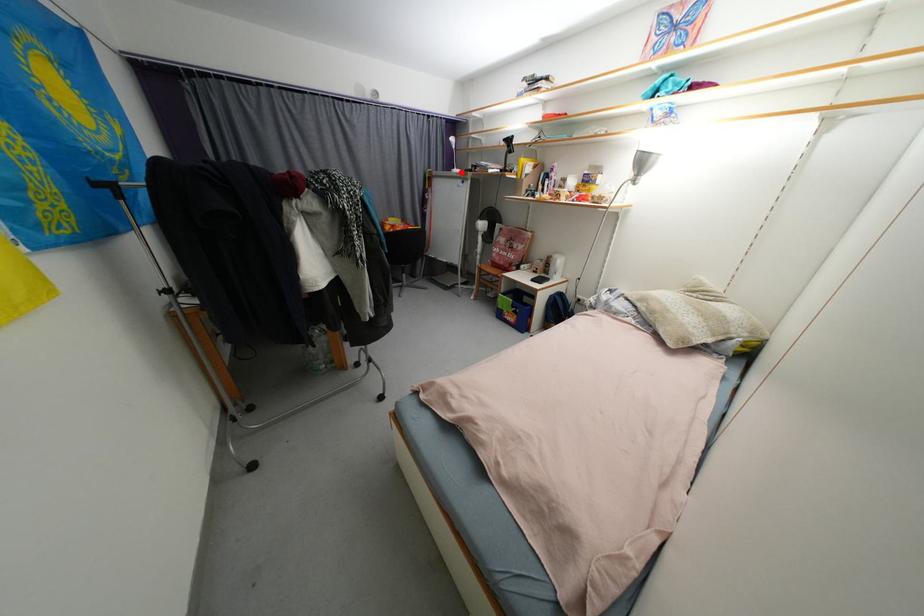
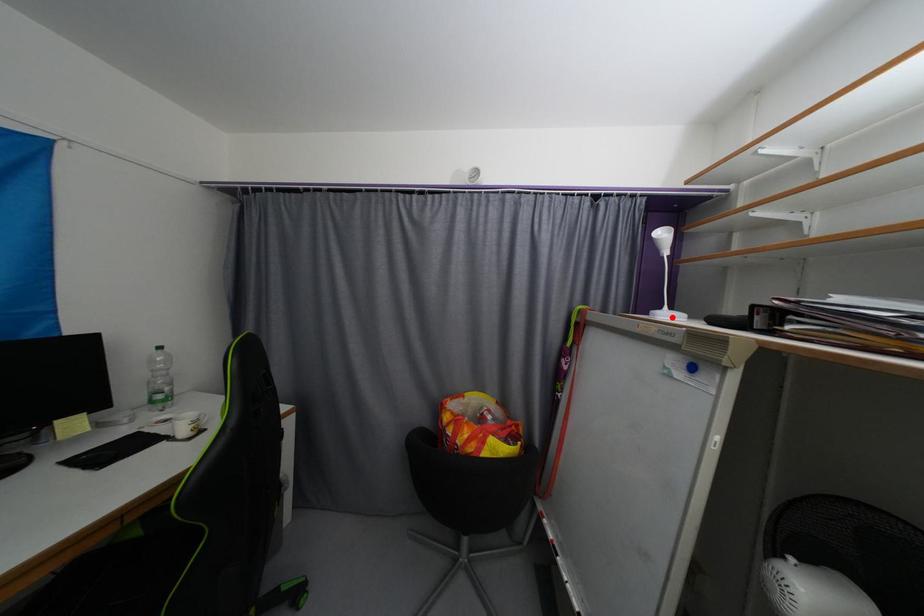
I am providing you with two images of the same scene from different viewpoints. A red point is marked on the first image and another point is marked on the second image. Do the highlighted points in image1 and image2 indicate the same real-world spot?

Yes